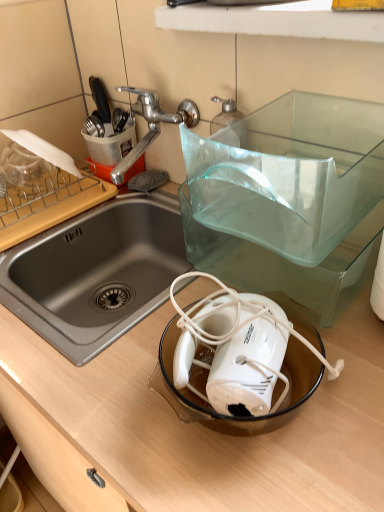
This screenshot has height=512, width=384. Describe the element at coordinates (239, 370) in the screenshot. I see `white plastic mixer at center` at that location.

The width and height of the screenshot is (384, 512). What do you see at coordinates (151, 125) in the screenshot? I see `silver metallic tap at upper left` at bounding box center [151, 125].

Where is `wooden cutting board at left`? The image size is (384, 512). wooden cutting board at left is located at coordinates (48, 204).

This screenshot has width=384, height=512. In order to click on wooden counter at center in this screenshot , I will do `click(203, 426)`.

From their relative heights in the image, would you say white plastic mixer at center is taller or shorter than wooden cutting board at left?

In the image, white plastic mixer at center appears to be taller than wooden cutting board at left.

From the image's perspective, is white plastic mixer at center under wooden cutting board at left?

Yes.

Which object is further away from the camera, white plastic mixer at center or wooden cutting board at left?

wooden cutting board at left is more distant.

Is silver metallic tap at upper left located outside wooden cutting board at left?

silver metallic tap at upper left lies outside wooden cutting board at left's area.

From the image's perspective, which is below, silver metallic tap at upper left or wooden cutting board at left?

From the image's view, wooden cutting board at left is below.

Is silver metallic tap at upper left next to wooden cutting board at left and touching it?

No, silver metallic tap at upper left is not in contact with wooden cutting board at left.

Considering the relative sizes of silver metallic tap at upper left and wooden cutting board at left in the image provided, is silver metallic tap at upper left wider than wooden cutting board at left?

Yes, silver metallic tap at upper left is wider than wooden cutting board at left.

Considering the relative sizes of white plastic mixer at center and wooden counter at center in the image provided, is white plastic mixer at center taller than wooden counter at center?

No.

From the image's perspective, is white plastic mixer at center under wooden counter at center?

No, from the image's perspective, white plastic mixer at center is not below wooden counter at center.

This screenshot has height=512, width=384. What are the coordinates of `counter top below the white plastic mixer at center (from a real-world perspective)` in the screenshot? It's located at (203, 426).

Is white plastic mixer at center aimed at wooden counter at center?

No, white plastic mixer at center does not turn towards wooden counter at center.

Considering the positions of point (54, 200) and point (365, 355), is point (54, 200) closer or farther from the camera than point (365, 355)?

Point (54, 200).

Based on the photo, looking at their sizes, would you say wooden cutting board at left is wider or thinner than wooden counter at center?

wooden cutting board at left is thinner than wooden counter at center.

From a real-world perspective, which is physically above, wooden cutting board at left or wooden counter at center?

In real-world perspective, wooden cutting board at left is above.

Do you think wooden counter at center is within wooden cutting board at left, or outside of it?

The correct answer is: outside.

Which of these two, wooden counter at center or wooden cutting board at left, is thinner?

wooden cutting board at left.

Looking at the image, does wooden cutting board at left seem bigger or smaller compared to silver metallic tap at upper left?

wooden cutting board at left is smaller than silver metallic tap at upper left.

Is wooden cutting board at left at the left side of silver metallic tap at upper left?

Indeed, wooden cutting board at left is positioned on the left side of silver metallic tap at upper left.

From their relative heights in the image, would you say wooden cutting board at left is taller or shorter than silver metallic tap at upper left?

In the image, wooden cutting board at left appears to be shorter than silver metallic tap at upper left.

Is wooden cutting board at left facing away from silver metallic tap at upper left?

No, wooden cutting board at left is not facing away from silver metallic tap at upper left.

Do you think wooden counter at center is within silver metallic tap at upper left, or outside of it?

The correct answer is: outside.

Considering the relative sizes of wooden counter at center and silver metallic tap at upper left in the image provided, is wooden counter at center thinner than silver metallic tap at upper left?

In fact, wooden counter at center might be wider than silver metallic tap at upper left.

Does wooden counter at center lie behind silver metallic tap at upper left?

No.

The height and width of the screenshot is (512, 384). In order to click on appliance on the right of wooden cutting board at left in this screenshot , I will do `click(239, 370)`.

The width and height of the screenshot is (384, 512). In order to click on cutting board below the silver metallic tap at upper left (from the image's perspective) in this screenshot , I will do `click(48, 204)`.

When comparing their distances from white plastic mixer at center, does wooden cutting board at left or wooden counter at center seem closer?

wooden counter at center is positioned closer to the anchor white plastic mixer at center.

Based on their spatial positions, is silver metallic tap at upper left or white plastic mixer at center closer to wooden cutting board at left?

silver metallic tap at upper left is positioned closer to the anchor wooden cutting board at left.

Looking at this image, considering their positions, is white plastic mixer at center positioned further to wooden counter at center than silver metallic tap at upper left?

silver metallic tap at upper left.

Considering their positions, is silver metallic tap at upper left positioned closer to wooden cutting board at left than wooden counter at center?

Among the two, silver metallic tap at upper left is located nearer to wooden cutting board at left.

Looking at the image, which one is located further to white plastic mixer at center, wooden cutting board at left or silver metallic tap at upper left?

Based on the image, wooden cutting board at left appears to be further to white plastic mixer at center.

Looking at the image, which one is located closer to silver metallic tap at upper left, white plastic mixer at center or wooden counter at center?

white plastic mixer at center.

Which object lies further to the anchor point wooden counter at center, white plastic mixer at center or wooden cutting board at left?

wooden cutting board at left is further to wooden counter at center.

Considering their positions, is wooden counter at center positioned closer to wooden cutting board at left than silver metallic tap at upper left?

Among the two, silver metallic tap at upper left is located nearer to wooden cutting board at left.

What are the coordinates of `cutting board between silver metallic tap at upper left and wooden counter at center from top to bottom` in the screenshot? It's located at (48, 204).

You are a GUI agent. You are given a task and a screenshot of the screen. Output one action in this format:
    pyautogui.click(x=<x>, y=<y>)
    Task: Click on the appliance located between wooden counter at center and wooden cutting board at left in the depth direction
    This screenshot has width=384, height=512.
    Given the screenshot: What is the action you would take?
    pyautogui.click(x=239, y=370)

Where is `appliance between silver metallic tap at upper left and wooden counter at center in the up-down direction`? The image size is (384, 512). appliance between silver metallic tap at upper left and wooden counter at center in the up-down direction is located at coordinates (239, 370).

Where is `tap positioned between white plastic mixer at center and wooden cutting board at left from near to far`? The image size is (384, 512). tap positioned between white plastic mixer at center and wooden cutting board at left from near to far is located at coordinates tap(151, 125).